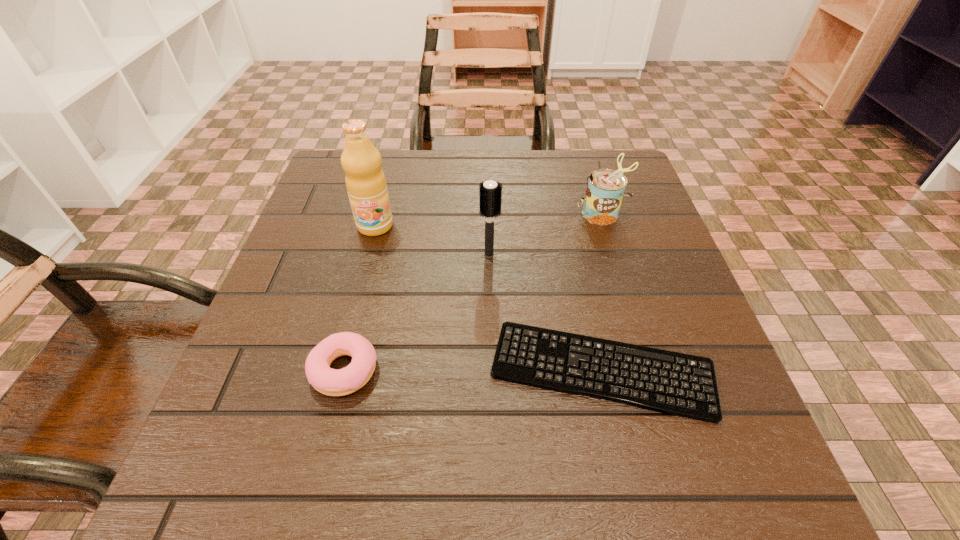
The width and height of the screenshot is (960, 540). What are the coordinates of `fruit juice` in the screenshot? It's located at (366, 185).

The width and height of the screenshot is (960, 540). Find the location of `the third nearest object`. the third nearest object is located at coordinates (490, 193).

This screenshot has width=960, height=540. In order to click on the second tallest object in this screenshot , I will do `click(490, 193)`.

You are a GUI agent. You are given a task and a screenshot of the screen. Output one action in this format:
    pyautogui.click(x=<x>, y=<y>)
    Task: Click on the third tallest object
    This screenshot has height=540, width=960.
    Given the screenshot: What is the action you would take?
    pyautogui.click(x=605, y=190)

The height and width of the screenshot is (540, 960). Find the location of `the second shortest object`. the second shortest object is located at coordinates (328, 381).

Image resolution: width=960 pixels, height=540 pixels. In order to click on computer keyboard in this screenshot , I will do `click(674, 383)`.

The image size is (960, 540). In order to click on vacant space located 0.310m on the front label of the tallest object in this screenshot , I will do `click(340, 363)`.

At what (x,y) coordinates should I click in order to perform the action: click on vacant region located on the right of the third nearest object. Please return your answer as a coordinate pair (x, y). Looking at the image, I should click on (623, 255).

The height and width of the screenshot is (540, 960). Identify the location of vacant space situated on the front of the third shortest object. (634, 319).

You are a GUI agent. You are given a task and a screenshot of the screen. Output one action in this format:
    pyautogui.click(x=<x>, y=<y>)
    Task: Click on the vacant space located on the back of the doughnut
    
    Given the screenshot: What is the action you would take?
    pyautogui.click(x=381, y=219)